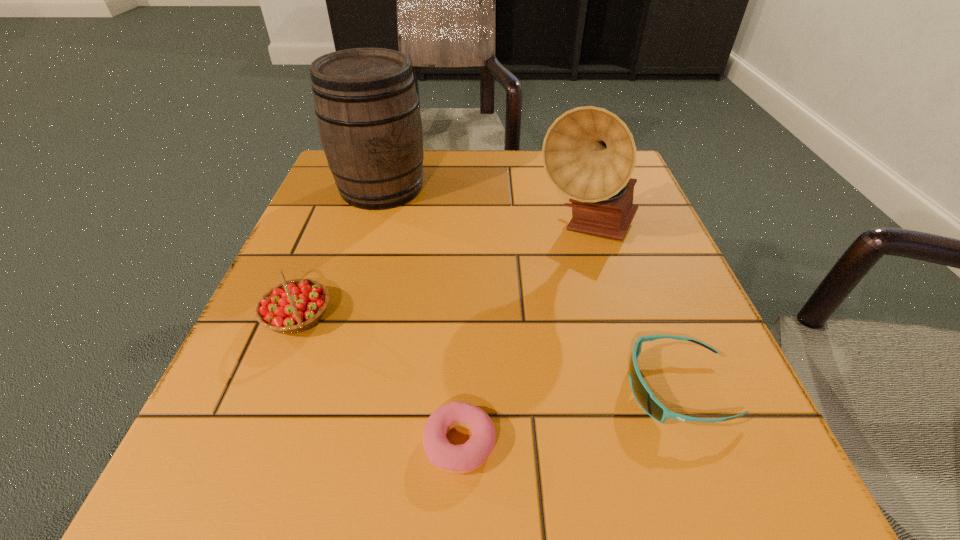
The width and height of the screenshot is (960, 540). Identify the location of wine bucket. (367, 108).

The height and width of the screenshot is (540, 960). Find the location of `phonograph record`. phonograph record is located at coordinates (589, 154).

Find the location of `the third nearest object`. the third nearest object is located at coordinates (293, 306).

Where is `the third tallest object`? The image size is (960, 540). the third tallest object is located at coordinates (293, 306).

In order to click on the second shortest object in this screenshot , I will do `click(644, 396)`.

I want to click on doughnut, so click(457, 459).

At what (x,y) coordinates should I click in order to perform the action: click on the third object from left to right. Please return your answer as a coordinate pair (x, y). Image resolution: width=960 pixels, height=540 pixels. Looking at the image, I should click on (457, 459).

This screenshot has width=960, height=540. What are the coordinates of `vacant area located 0.260m on the right of the wine bucket` in the screenshot? It's located at (545, 188).

Where is `vacant space located 0.070m on the horn of the phonograph record`? vacant space located 0.070m on the horn of the phonograph record is located at coordinates (605, 291).

The image size is (960, 540). Identify the location of free location located 0.400m on the back of the third nearest object. (356, 171).